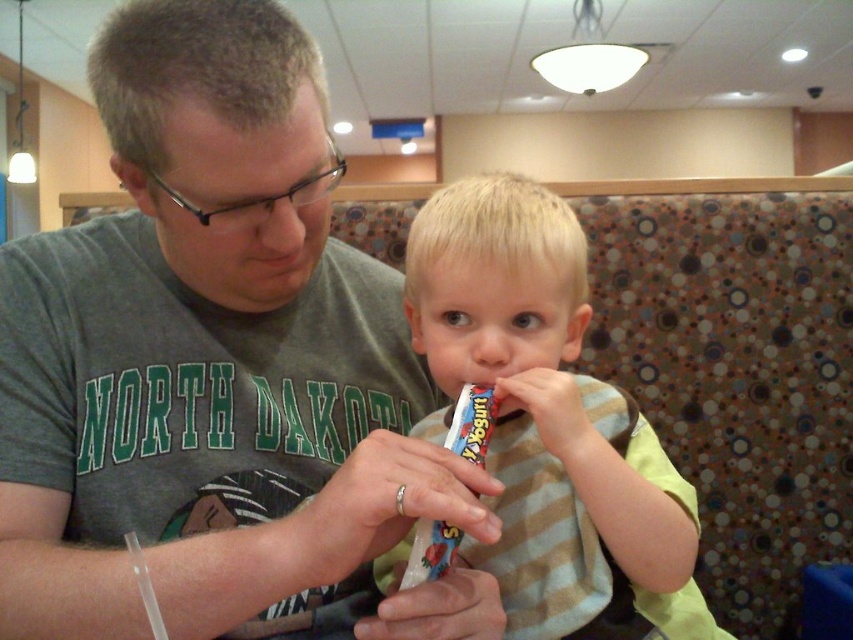
Question: Which object appears farthest from the camera in this image?

Choices:
 (A) multicolored plastic toothbrush at center
 (B) gray matte shirt at center
 (C) matte plastic yogurt at center

Answer: (A)

Question: Is gray matte shirt at center wider than matte plastic yogurt at center?

Choices:
 (A) yes
 (B) no

Answer: (A)

Question: Considering the relative positions of matte plastic yogurt at center and multicolored plastic toothbrush at center in the image provided, where is matte plastic yogurt at center located with respect to multicolored plastic toothbrush at center?

Choices:
 (A) below
 (B) above

Answer: (B)

Question: Which of these objects is positioned farthest from the multicolored plastic toothbrush at center?

Choices:
 (A) gray matte shirt at center
 (B) matte plastic yogurt at center

Answer: (A)

Question: Which point is farther from the camera taking this photo?

Choices:
 (A) (13, 368)
 (B) (480, 433)

Answer: (A)

Question: Does gray matte shirt at center come in front of matte plastic yogurt at center?

Choices:
 (A) yes
 (B) no

Answer: (A)